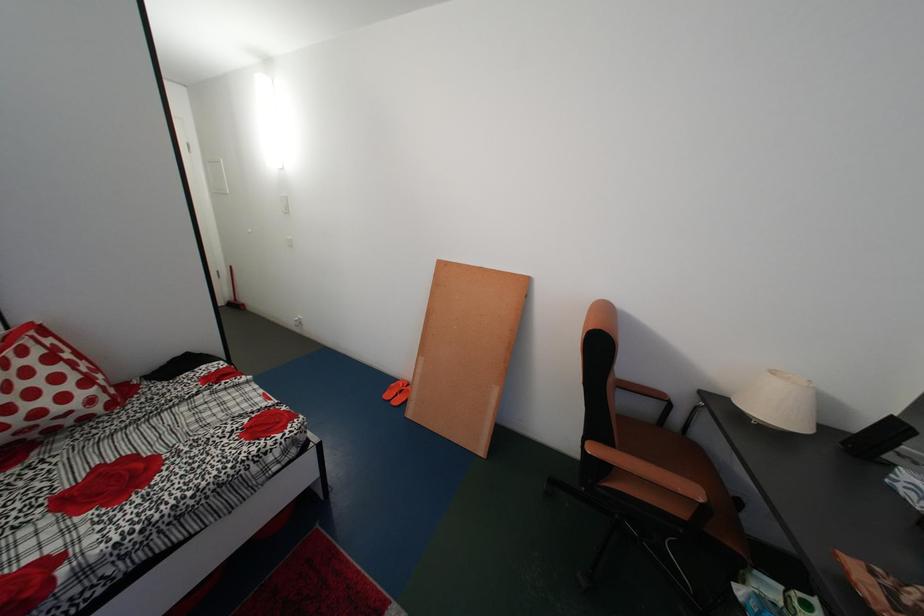
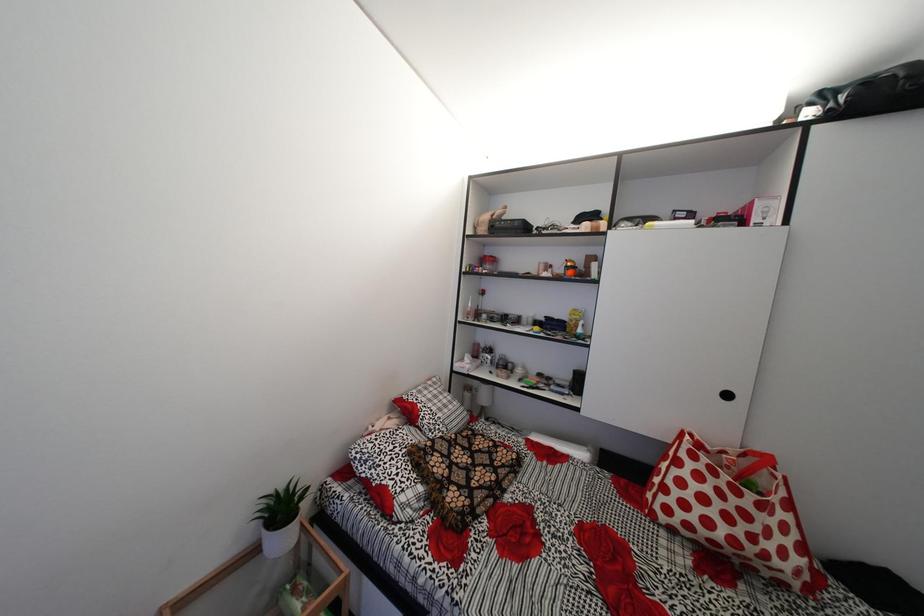
Question: How did the camera likely rotate?

Choices:
 (A) Left
 (B) Right
 (C) Up
 (D) Down

Answer: (A)